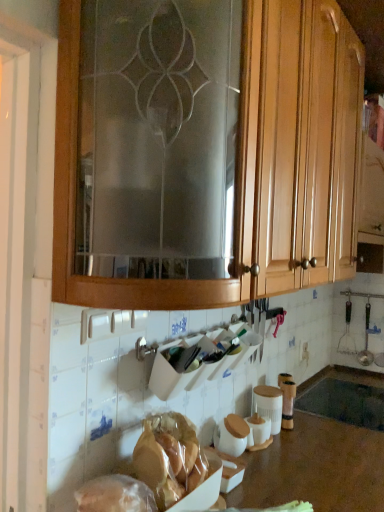
Question: Is translucent plastic bag at lower left, which is the first food in back-to-front order, next to brown polished wood at lower center and touching it?

Choices:
 (A) yes
 (B) no

Answer: (B)

Question: From a real-world perspective, is translucent plastic bag at lower left, which is the first food in back-to-front order, physically below brown polished wood at lower center?

Choices:
 (A) no
 (B) yes

Answer: (A)

Question: From a real-world perspective, is translucent plastic bag at lower left, which is counted as the 2th food, starting from the front, over brown polished wood at lower center?

Choices:
 (A) yes
 (B) no

Answer: (A)

Question: Is translucent plastic bag at lower left, which is the first food in back-to-front order, to the right of brown polished wood at lower center from the viewer's perspective?

Choices:
 (A) no
 (B) yes

Answer: (A)

Question: Does translucent plastic bag at lower left, which is counted as the 2th food, starting from the front, have a lesser width compared to brown polished wood at lower center?

Choices:
 (A) yes
 (B) no

Answer: (A)

Question: Does point (281, 397) appear closer or farther from the camera than point (210, 492)?

Choices:
 (A) farther
 (B) closer

Answer: (A)

Question: Considering the positions of matte brown jar at lower center and translucent plastic bag of bread at lower center, which ranks as the second food in back-to-front order, in the image, is matte brown jar at lower center taller or shorter than translucent plastic bag of bread at lower center, which ranks as the second food in back-to-front order,?

Choices:
 (A) tall
 (B) short

Answer: (A)

Question: From the image's perspective, relative to translucent plastic bag of bread at lower center, which ranks as the second food in back-to-front order, is matte brown jar at lower center above or below?

Choices:
 (A) below
 (B) above

Answer: (A)

Question: From a real-world perspective, is matte brown jar at lower center above or below translucent plastic bag of bread at lower center, which ranks as the second food in back-to-front order?

Choices:
 (A) above
 (B) below

Answer: (B)

Question: From the image's perspective, relative to translucent plastic bag at lower left, which is the first food in back-to-front order, is wooden cabinet at upper center above or below?

Choices:
 (A) above
 (B) below

Answer: (A)

Question: Relative to translucent plastic bag at lower left, which is the first food in back-to-front order, is wooden cabinet at upper center in front or behind?

Choices:
 (A) behind
 (B) front

Answer: (B)

Question: Is wooden cabinet at upper center inside or outside of translucent plastic bag at lower left, which is counted as the 2th food, starting from the front?

Choices:
 (A) outside
 (B) inside

Answer: (A)

Question: From a real-world perspective, is wooden cabinet at upper center physically located above or below translucent plastic bag at lower left, which is the first food in back-to-front order?

Choices:
 (A) above
 (B) below

Answer: (A)

Question: In the image, is translucent plastic bag of bread at lower center, which ranks as the second food in back-to-front order, on the left side or the right side of translucent plastic bag at lower left, which is the first food in back-to-front order?

Choices:
 (A) left
 (B) right

Answer: (B)

Question: In the image, is translucent plastic bag of bread at lower center, which ranks as the second food in back-to-front order, positioned in front of or behind translucent plastic bag at lower left, which is the first food in back-to-front order?

Choices:
 (A) behind
 (B) front

Answer: (B)